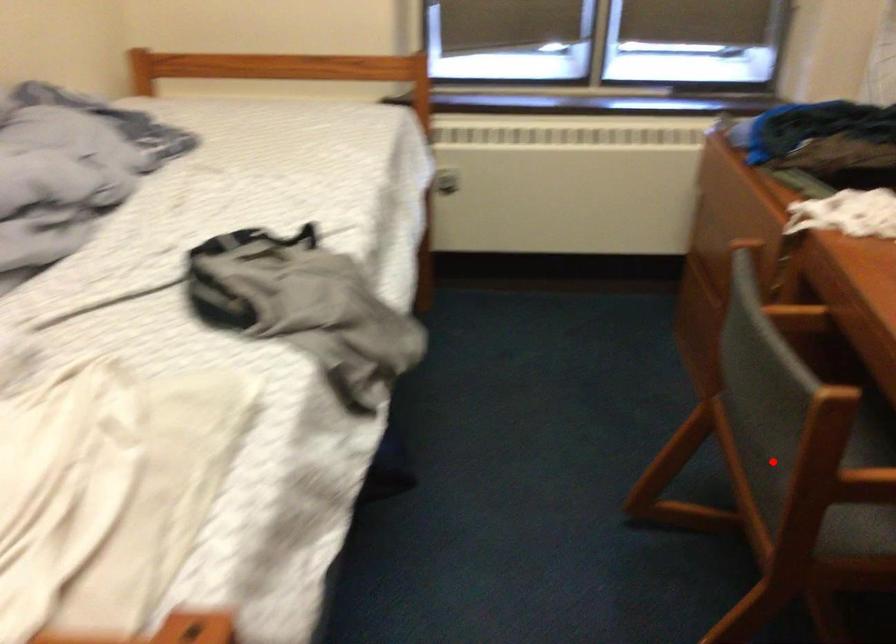
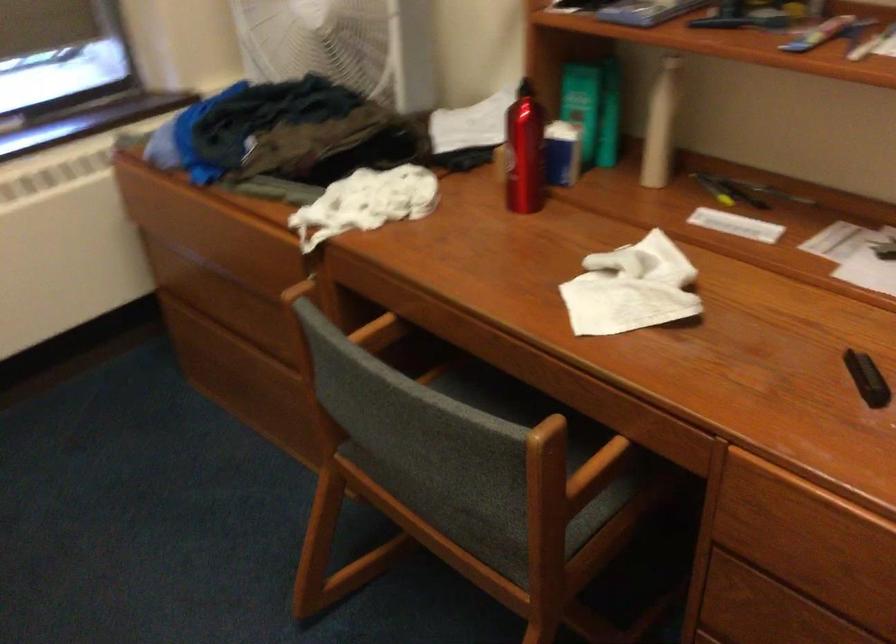
Question: I am providing you with two images of the same scene from different viewpoints. Image1 has a red point marked. In image2, the corresponding 3D location appears at what relative position? Reply with the corresponding letter.

Choices:
 (A) Closer
 (B) Farther

Answer: (A)